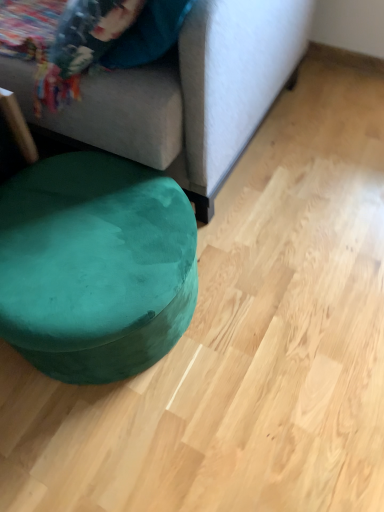
Find the location of a particular element. The width and height of the screenshot is (384, 512). free space in front of velvet green bean bag at lower left is located at coordinates (135, 442).